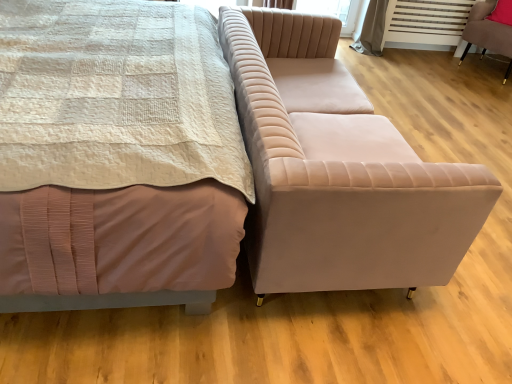
Question: From the image's perspective, is velvet beige couch at center above or below matte pink bed at center?

Choices:
 (A) above
 (B) below

Answer: (B)

Question: Do you think velvet beige couch at center is within matte pink bed at center, or outside of it?

Choices:
 (A) outside
 (B) inside

Answer: (A)

Question: Which is nearer to the matte pink bed at center?

Choices:
 (A) velvet pink chair at right
 (B) velvet beige couch at center
 (C) pink fabric pillow at upper right

Answer: (B)

Question: Based on their relative distances, which object is nearer to the velvet beige couch at center?

Choices:
 (A) velvet pink chair at right
 (B) matte pink bed at center
 (C) pink fabric pillow at upper right

Answer: (B)